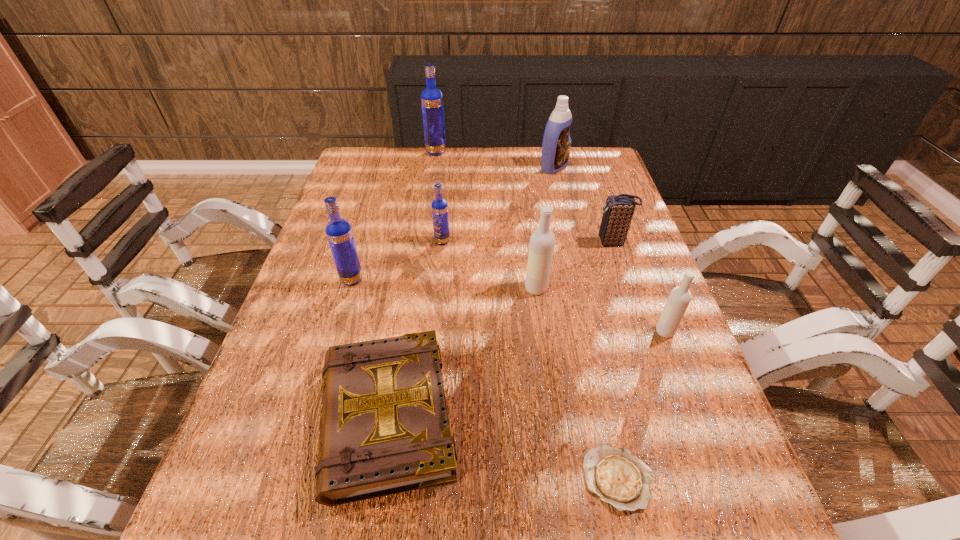
The image size is (960, 540). Identify the location of vacant region located on the front of the farther white vodka. (543, 343).

Identify the location of free region located on the left of the fourth nearest vodka. The width and height of the screenshot is (960, 540). (358, 241).

Identify the location of vacant area situated on the back of the nearer white vodka. This screenshot has height=540, width=960. (631, 243).

Image resolution: width=960 pixels, height=540 pixels. In order to click on blank space located with the zip open on the third shortest object in this screenshot , I will do `click(534, 242)`.

Find the location of a particular element. free region located 0.310m with the zip open on the third shortest object is located at coordinates (483, 242).

At what (x,y) coordinates should I click in order to perform the action: click on blank space located with the zip open on the third shortest object. Please return your answer as a coordinate pair (x, y). This screenshot has height=540, width=960. Looking at the image, I should click on (501, 242).

At what (x,y) coordinates should I click in order to perform the action: click on free space located on the back of the eighth tallest object. Please return your answer as a coordinate pair (x, y). This screenshot has height=540, width=960. Looking at the image, I should click on (404, 310).

Identify the location of vacant region located 0.090m on the left of the brown quiche. This screenshot has height=540, width=960. (533, 478).

Identify the location of vodka at the far edge. The height and width of the screenshot is (540, 960). (431, 98).

Where is `detergent present at the far edge`? detergent present at the far edge is located at coordinates click(556, 145).